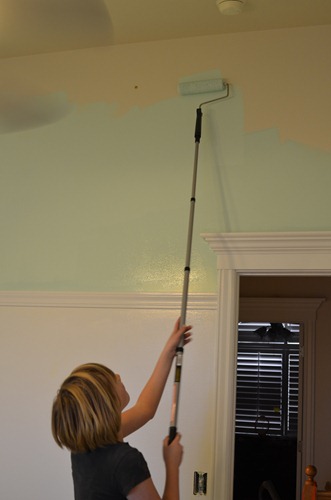
You are a GUI agent. You are given a task and a screenshot of the screen. Output one action in this format:
    pyautogui.click(x=<x>, y=<y>)
    Task: Click on the paint roller
    
    Given the screenshot: What is the action you would take?
    pyautogui.click(x=200, y=89)